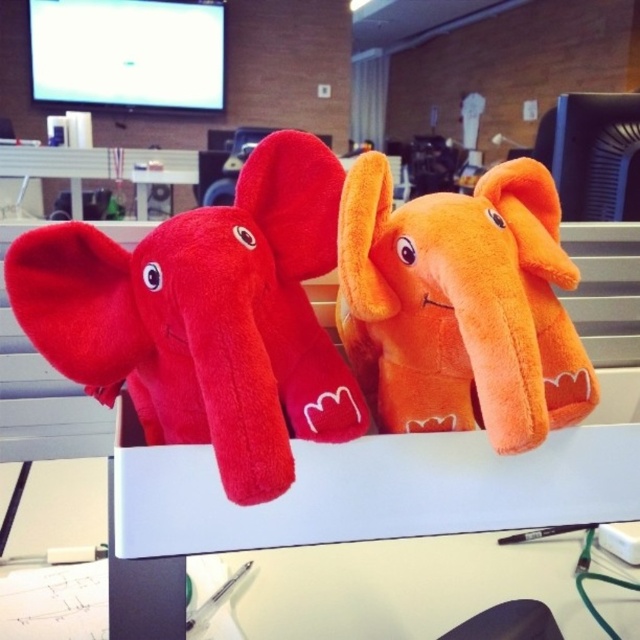
Question: Is velvety red elephant at center further to camera compared to orange plush elephant at center?

Choices:
 (A) no
 (B) yes

Answer: (A)

Question: Which of these objects is positioned farthest from the orange plush elephant at center?

Choices:
 (A) white plastic computer desk at upper center
 (B) velvety red elephant at center

Answer: (A)

Question: Considering the relative positions of velvety red elephant at center and orange plush elephant at center in the image provided, where is velvety red elephant at center located with respect to orange plush elephant at center?

Choices:
 (A) below
 (B) above

Answer: (A)

Question: Among these objects, which one is farthest from the camera?

Choices:
 (A) white plastic computer desk at upper center
 (B) orange plush elephant at center
 (C) velvety red elephant at center

Answer: (A)

Question: Can you confirm if velvety red elephant at center is bigger than orange plush elephant at center?

Choices:
 (A) no
 (B) yes

Answer: (B)

Question: Which is farther from the white plastic computer desk at upper center?

Choices:
 (A) orange plush elephant at center
 (B) velvety red elephant at center

Answer: (A)